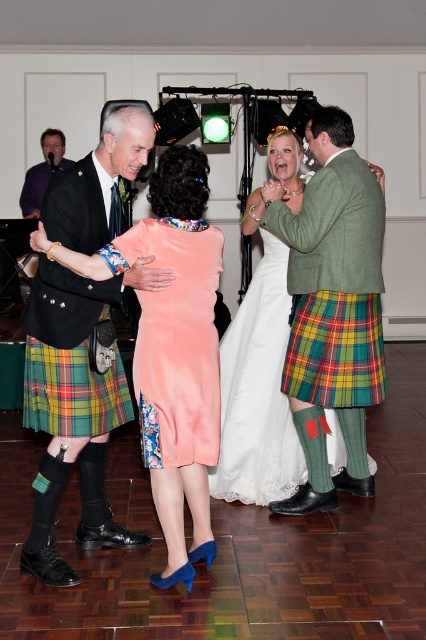
Can you confirm if silky coral dress at center is smaller than peach velvet dress at center?

Actually, silky coral dress at center might be larger than peach velvet dress at center.

Is silky coral dress at center bigger than peach velvet dress at center?

Yes.

I want to click on silky coral dress at center, so click(172, 349).

Can you confirm if matte green kilt at center is positioned below plaid fabric kilt at center?

No.

Looking at this image, between matte green kilt at center and plaid fabric kilt at center, which one has less height?

With less height is plaid fabric kilt at center.

This screenshot has height=640, width=426. What do you see at coordinates (66, 352) in the screenshot?
I see `matte green kilt at center` at bounding box center [66, 352].

Locate an element on the screen. Image resolution: width=426 pixels, height=640 pixels. matte green kilt at center is located at coordinates (66, 352).

Based on the photo, does silky coral dress at center have a lesser width compared to matte green kilt at center?

No.

Is silky coral dress at center bigger than matte green kilt at center?

Correct, silky coral dress at center is larger in size than matte green kilt at center.

Is point (154, 456) more distant than point (66, 278)?

Yes, it is behind point (66, 278).

Locate an element on the screen. silky coral dress at center is located at coordinates (172, 349).